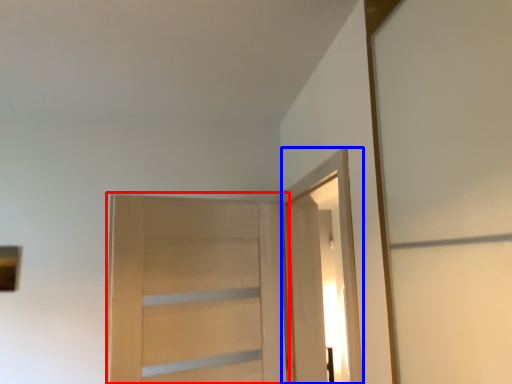
Question: Which object appears closest to the camera in this image, door (highlighted by a red box) or elevator (highlighted by a blue box)?

Choices:
 (A) door
 (B) elevator

Answer: (B)